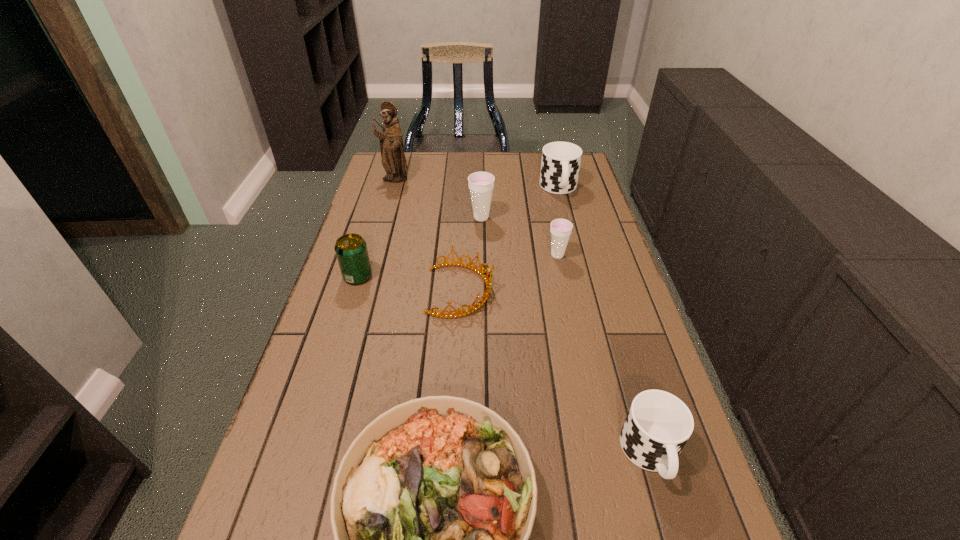
Identify the location of the tallest object. (393, 160).

Locate an element on the screen. The image size is (960, 540). the leftmost cup is located at coordinates (481, 184).

Locate an element on the screen. The image size is (960, 540). the third nearest cup is located at coordinates [x=481, y=184].

Identify the location of the farther black cup. The height and width of the screenshot is (540, 960). (560, 165).

What are the coordinates of `the farthest cup` in the screenshot? It's located at (560, 165).

At what (x,y) coordinates should I click in order to perform the action: click on green beer can. Please return your answer as a coordinate pair (x, y). The width and height of the screenshot is (960, 540). Looking at the image, I should click on (351, 250).

Find the location of `the right purple cup`. the right purple cup is located at coordinates (561, 229).

Image resolution: width=960 pixels, height=540 pixels. Find the location of `the fourth farthest object`. the fourth farthest object is located at coordinates (561, 229).

Locate an element on the screen. The width and height of the screenshot is (960, 540). the nearest cup is located at coordinates (658, 425).

Find the location of a particular element. the smaller black cup is located at coordinates (658, 425).